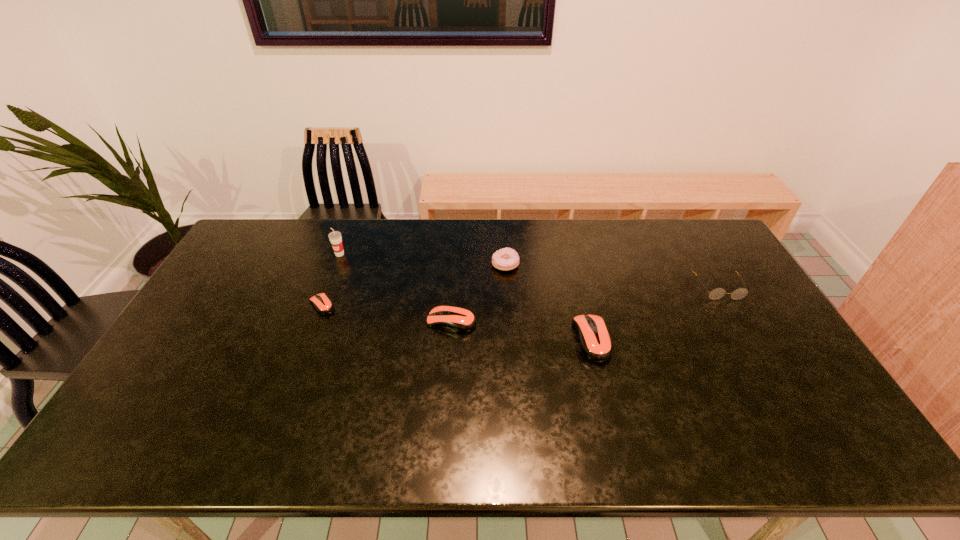
You are a GUI agent. You are given a task and a screenshot of the screen. Output one action in this format:
    pyautogui.click(x=<x>, y=<y>)
    Task: Click on the vacant space located on the back of the rightmost computer mouse
    
    Given the screenshot: What is the action you would take?
    pyautogui.click(x=577, y=278)

Locate an element on the screen. The width and height of the screenshot is (960, 540). free space located 0.060m on the right of the doughnut is located at coordinates (537, 265).

Where is `blank area located 0.340m on the side of the tallest object with the logo`? The height and width of the screenshot is (540, 960). blank area located 0.340m on the side of the tallest object with the logo is located at coordinates (310, 333).

Identify the location of vacant space situated 0.090m on the temples of the spectacles. The width and height of the screenshot is (960, 540). (738, 323).

Where is `doughnut that is at the far edge`? The width and height of the screenshot is (960, 540). doughnut that is at the far edge is located at coordinates (505, 259).

Image resolution: width=960 pixels, height=540 pixels. Identify the location of cup present at the far edge. (335, 237).

The width and height of the screenshot is (960, 540). Find the location of `object located at the right edge`. object located at the right edge is located at coordinates (717, 293).

You are a GUI agent. You are given a task and a screenshot of the screen. Output one action in this format:
    pyautogui.click(x=<x>, y=<y>)
    Task: Click on the vacant area at the far edge
    The image size is (960, 540).
    Given the screenshot: What is the action you would take?
    pyautogui.click(x=563, y=256)

Where is `vacant area at the near edge of the desktop`? This screenshot has width=960, height=540. vacant area at the near edge of the desktop is located at coordinates (534, 399).

Locate an element on the screen. Image resolution: width=960 pixels, height=540 pixels. free space at the left edge of the desktop is located at coordinates (251, 276).